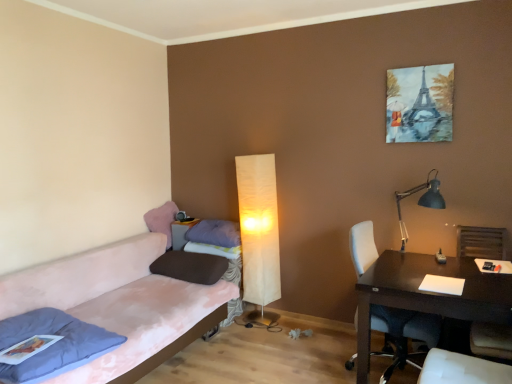
I want to click on vacant space that is to the left of white leather chair at right, so click(x=298, y=360).